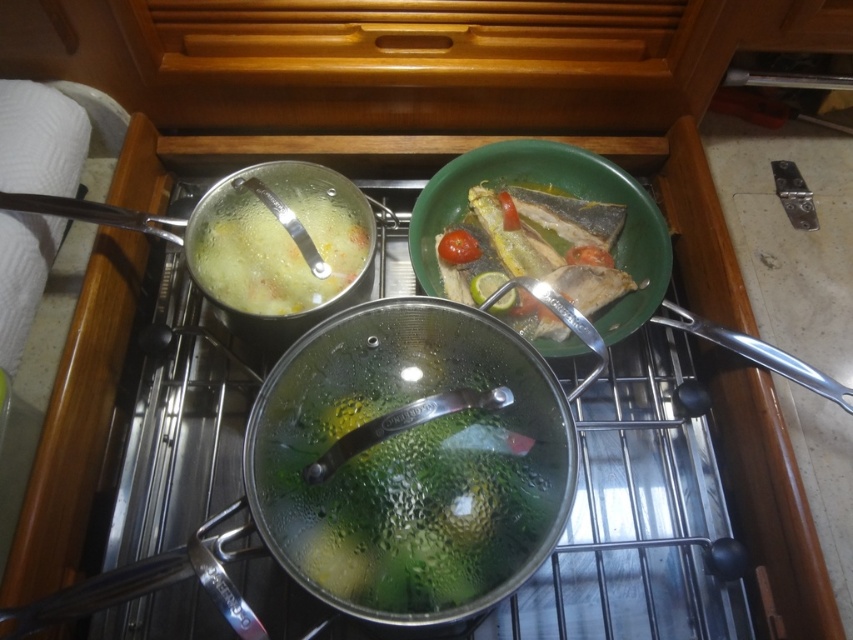
Is green matte fish at center taller than translucent glass soup at upper left?

Correct, green matte fish at center is much taller as translucent glass soup at upper left.

Is green matte fish at center to the right of translucent glass soup at upper left from the viewer's perspective?

Correct, you'll find green matte fish at center to the right of translucent glass soup at upper left.

Where is `green matte fish at center`? The image size is (853, 640). green matte fish at center is located at coordinates (540, 244).